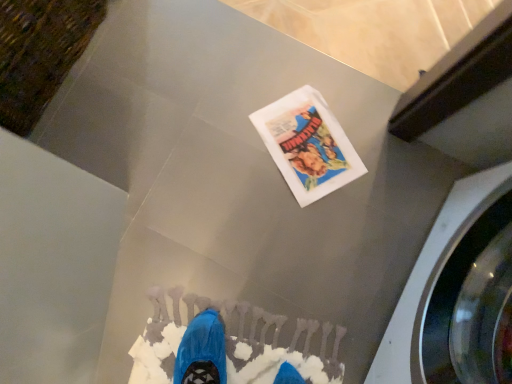
You are a GUI agent. You are given a task and a screenshot of the screen. Output one action in this format:
    pyautogui.click(x=<x>, y=<y>)
    Task: Click on the free spot behind white paper flyer at center
    The height and width of the screenshot is (384, 512).
    Given the screenshot: What is the action you would take?
    [308, 84]